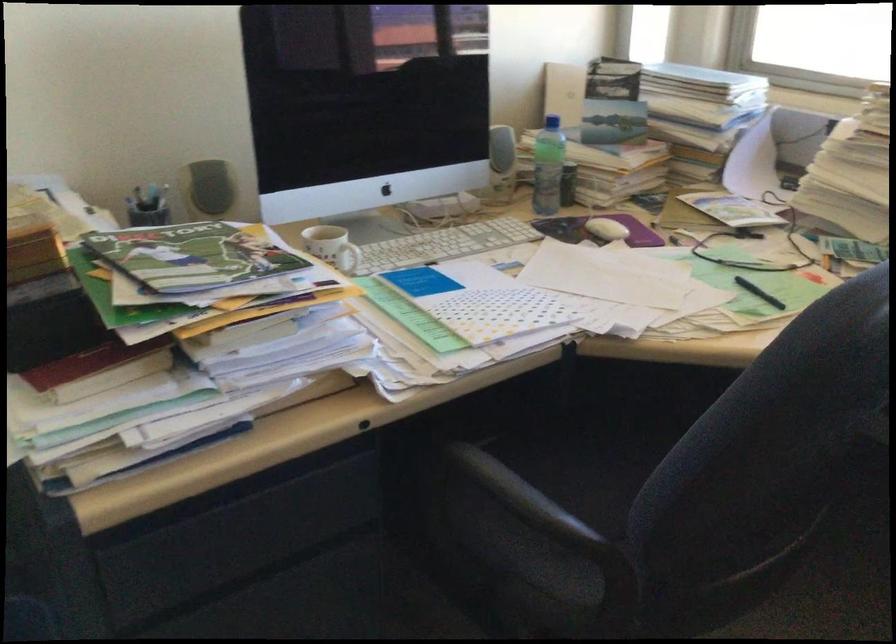
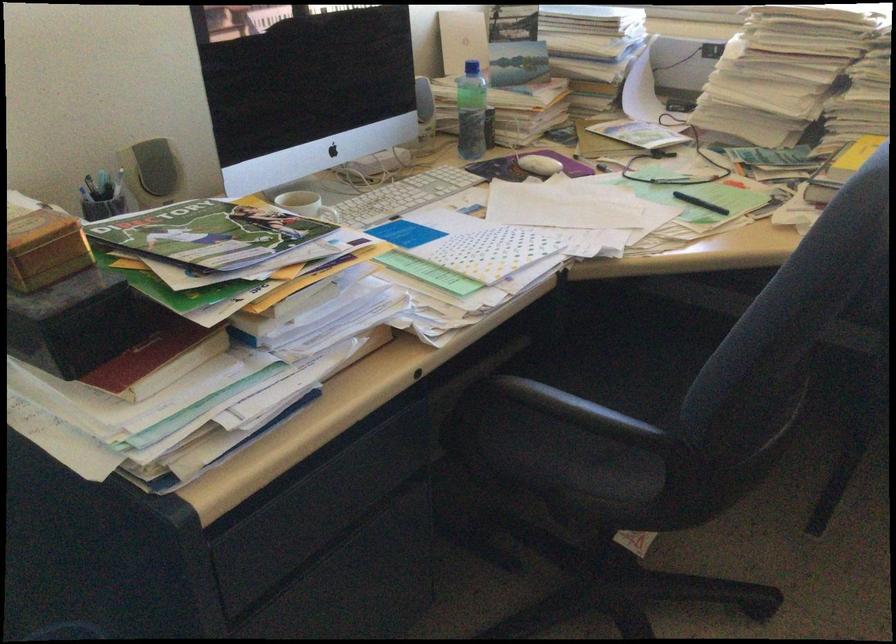
Locate, in the second image, the point that corresponds to the point at 630,455 in the first image.

(618, 365)